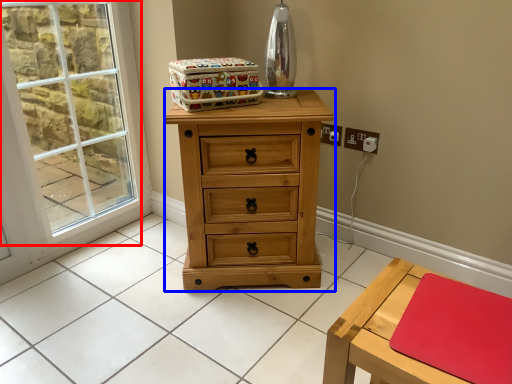
Question: Which object is closer to the camera taking this photo, window (highlighted by a red box) or chest of drawers (highlighted by a blue box)?

Choices:
 (A) window
 (B) chest of drawers

Answer: (B)